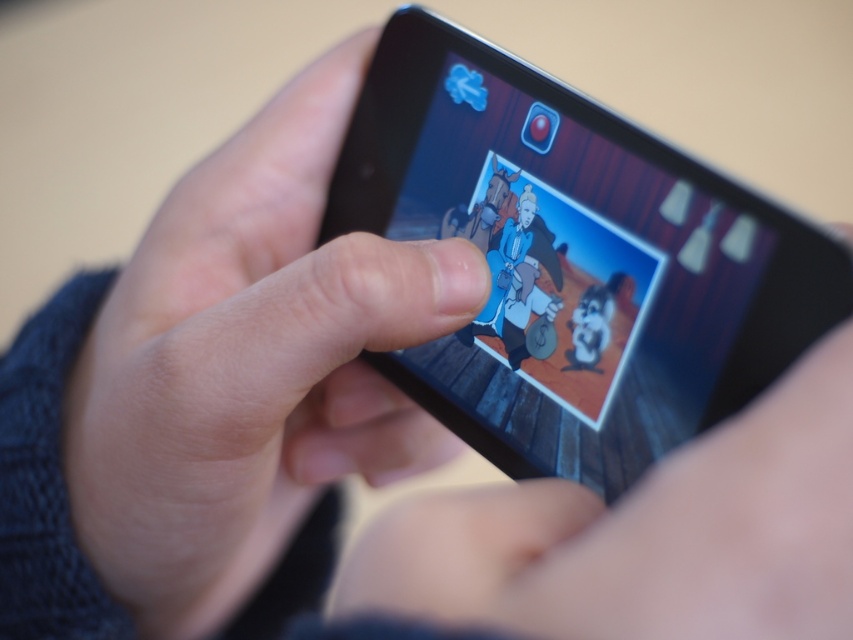
Question: Is smooth skin hand at center positioned at the back of black matte smartphone at center?

Choices:
 (A) no
 (B) yes

Answer: (B)

Question: Can you confirm if smooth skin hand at center is bigger than black matte smartphone at center?

Choices:
 (A) yes
 (B) no

Answer: (A)

Question: Which point is farther to the camera?

Choices:
 (A) (405, 416)
 (B) (671, 189)

Answer: (A)

Question: Does smooth skin hand at center come behind black matte smartphone at center?

Choices:
 (A) yes
 (B) no

Answer: (A)